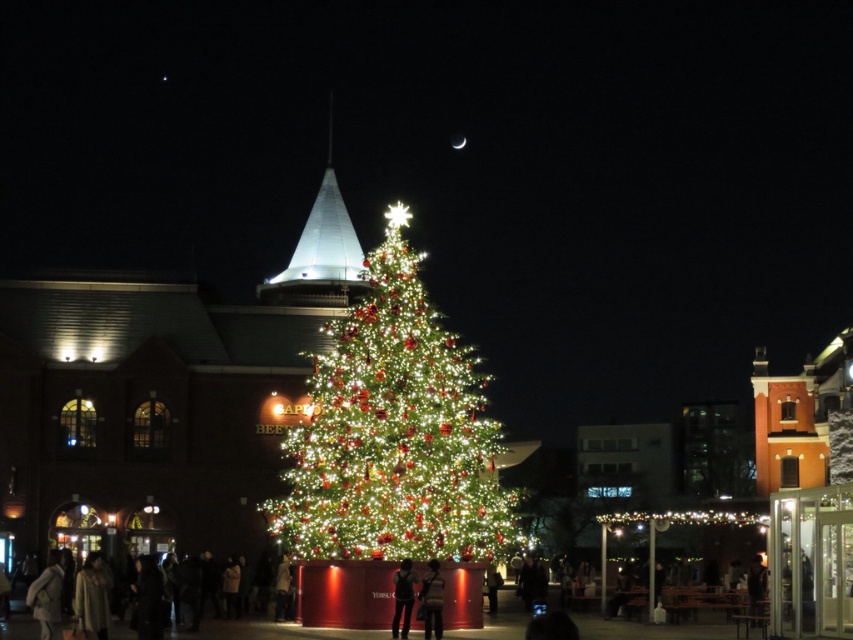
Between point (315, 259) and point (399, 568), which one is positioned in front?

Point (399, 568) is more forward.

Is white glossy spire at center wider than dark clothing at center?

Yes, white glossy spire at center is wider than dark clothing at center.

At what (x,y) coordinates should I click in order to perform the action: click on white glossy spire at center. Please return your answer as a coordinate pair (x, y). Looking at the image, I should click on (321, 252).

Does dark gray fabric jacket at center have a lesser height compared to dark clothing at center?

Yes, dark gray fabric jacket at center is shorter than dark clothing at center.

Locate an element on the screen. The height and width of the screenshot is (640, 853). dark gray fabric jacket at center is located at coordinates (432, 600).

Does point (437, 596) come in front of point (396, 595)?

Yes, it is in front of point (396, 595).

Locate an element on the screen. This screenshot has width=853, height=640. dark gray fabric jacket at center is located at coordinates [x=432, y=600].

Is white glossy spire at center to the left of dark gray fabric jacket at center from the viewer's perspective?

Correct, you'll find white glossy spire at center to the left of dark gray fabric jacket at center.

Find the location of a particular element. The width and height of the screenshot is (853, 640). white glossy spire at center is located at coordinates (321, 252).